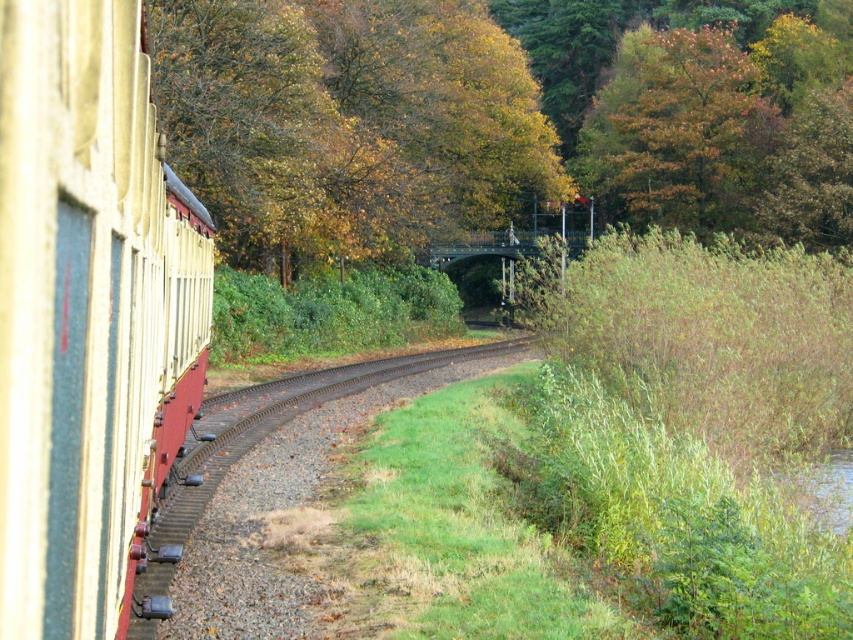
You are standing at the center of the image. Which direction should you walk to reach the matte cream train car at left?

You should walk to the left to reach the matte cream train car at left since it is located at the left side of the image.